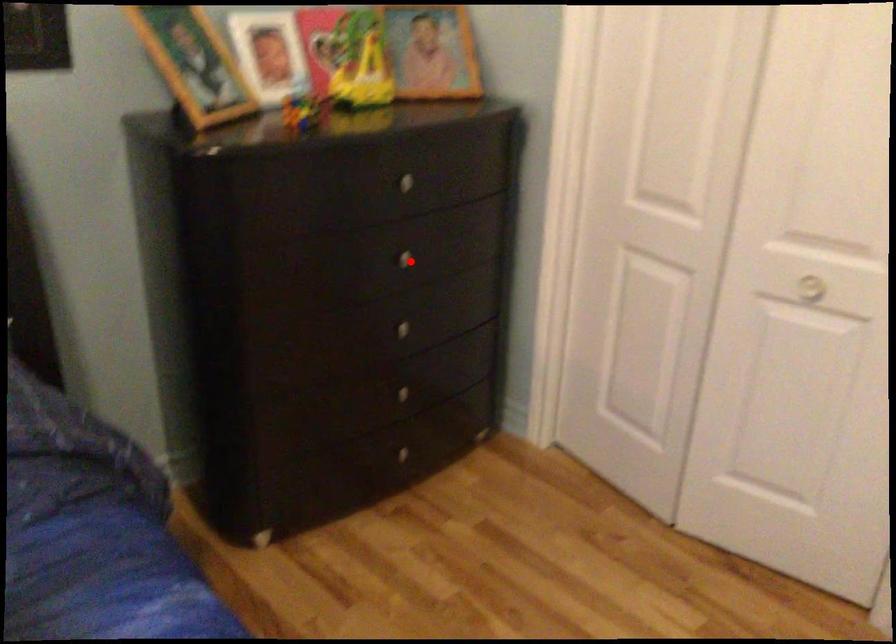
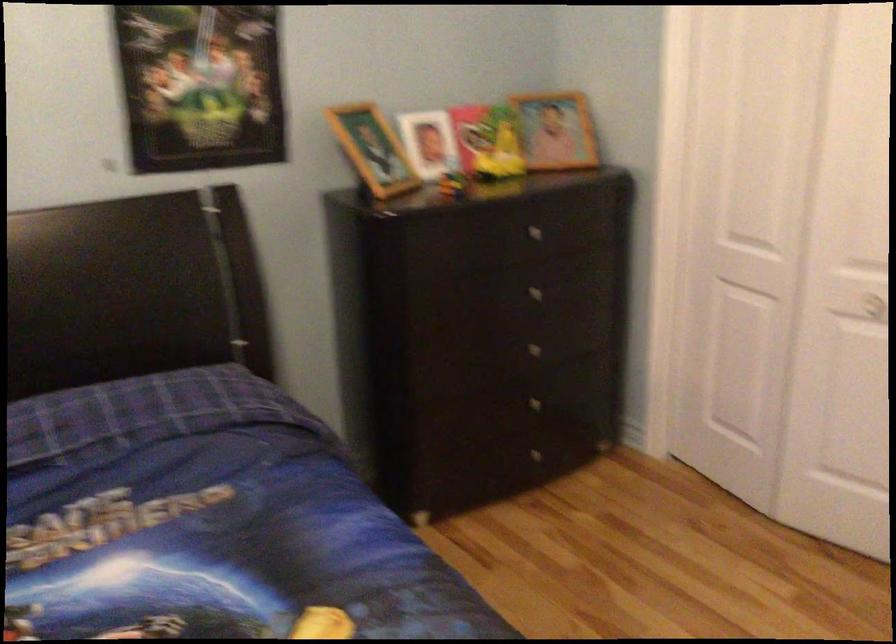
Question: I am providing you with two images of the same scene from different viewpoints. In image1, a red point is highlighted. Considering the same 3D point in image2, which of the following is correct?

Choices:
 (A) It is closer
 (B) It is farther

Answer: (B)